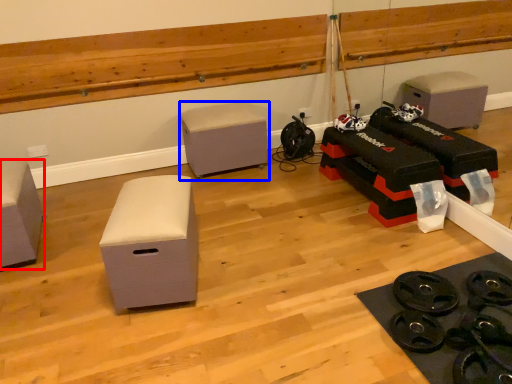
Question: Which point is further to the camera, furniture (highlighted by a red box) or furniture (highlighted by a blue box)?

Choices:
 (A) furniture
 (B) furniture

Answer: (B)